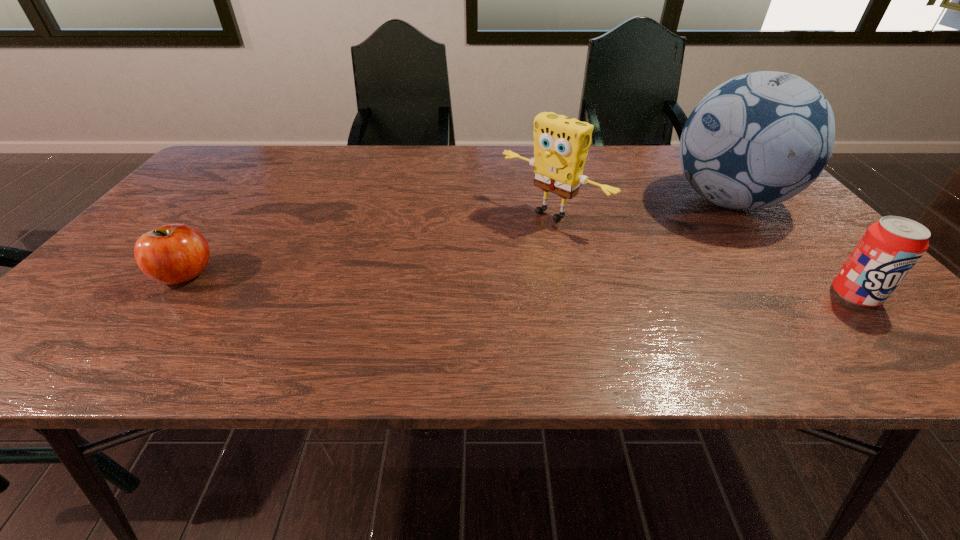
Where is `free spot on the desktop that is between the shortest object and the third tallest object and is positioned on the face of the second object from left to right`? This screenshot has width=960, height=540. free spot on the desktop that is between the shortest object and the third tallest object and is positioned on the face of the second object from left to right is located at coordinates (462, 283).

Identify the location of vacant space on the desktop that is between the leftmost object and the third tallest object and is positioned on the side with brand of the soccer ball. Image resolution: width=960 pixels, height=540 pixels. (508, 285).